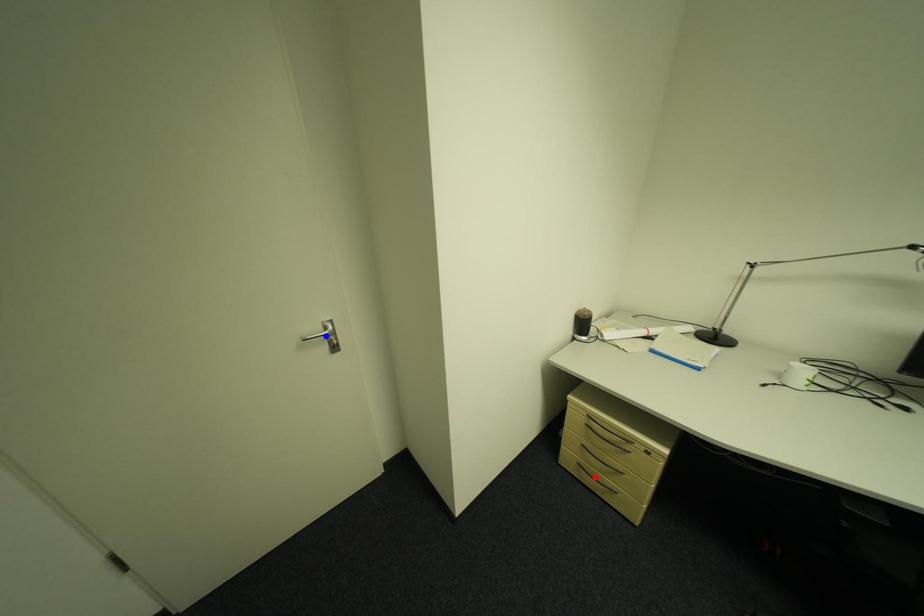
Question: Which of the two points in the image is closer to the camera?

Choices:
 (A) Blue point is closer.
 (B) Red point is closer.

Answer: (A)